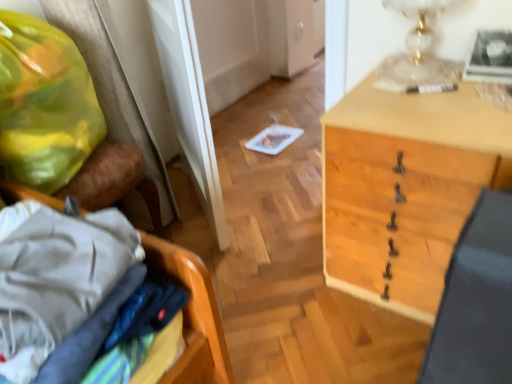
Question: In the image, is white glass table lamp at upper right positioned in front of or behind yellow plastic bag at left?

Choices:
 (A) behind
 (B) front

Answer: (A)

Question: Considering the positions of white glass table lamp at upper right and yellow plastic bag at left in the image, is white glass table lamp at upper right taller or shorter than yellow plastic bag at left?

Choices:
 (A) short
 (B) tall

Answer: (A)

Question: Which object is positioned farthest from the wooden desk at center?

Choices:
 (A) white glass table lamp at upper right
 (B) wooden laundry basket at left
 (C) yellow plastic bag at left
 (D) black leather swivel chair at lower right

Answer: (C)

Question: Which of these objects is positioned farthest from the white glass table lamp at upper right?

Choices:
 (A) yellow plastic bag at left
 (B) black leather swivel chair at lower right
 (C) wooden laundry basket at left
 (D) wooden desk at center

Answer: (A)